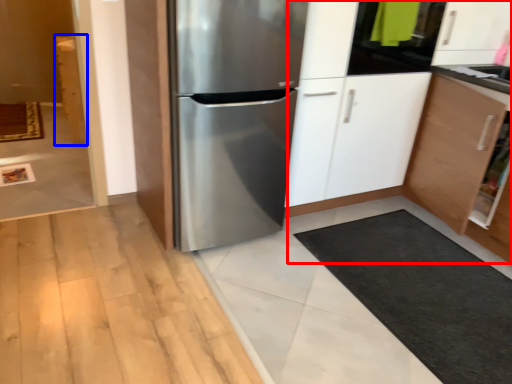
Question: Which object appears farthest to the camera in this image, dresser (highlighted by a red box) or cabinetry (highlighted by a blue box)?

Choices:
 (A) dresser
 (B) cabinetry

Answer: (B)